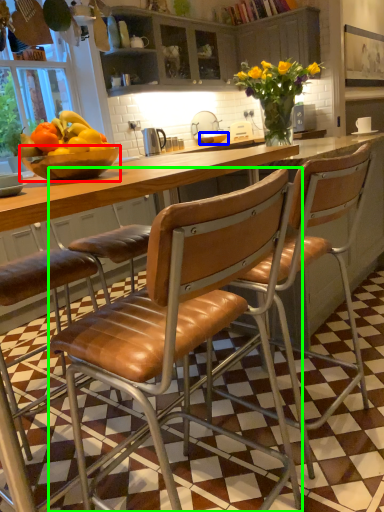
Question: Estimate the real-world distances between objects in this image. Which object is closer to bowl (highlighted by a red box), bowl (highlighted by a blue box) or chair (highlighted by a green box)?

Choices:
 (A) bowl
 (B) chair

Answer: (B)